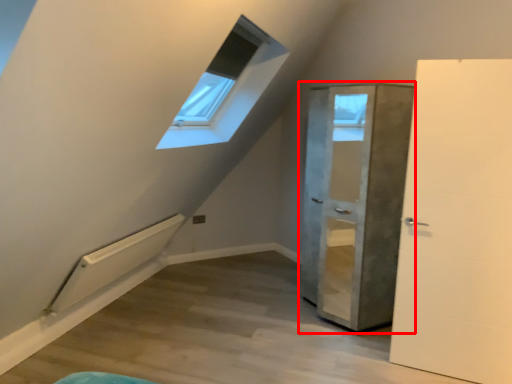
Question: Considering the relative positions of door (annotated by the red box) and door in the image provided, where is door (annotated by the red box) located with respect to the staircase?

Choices:
 (A) left
 (B) right

Answer: (A)